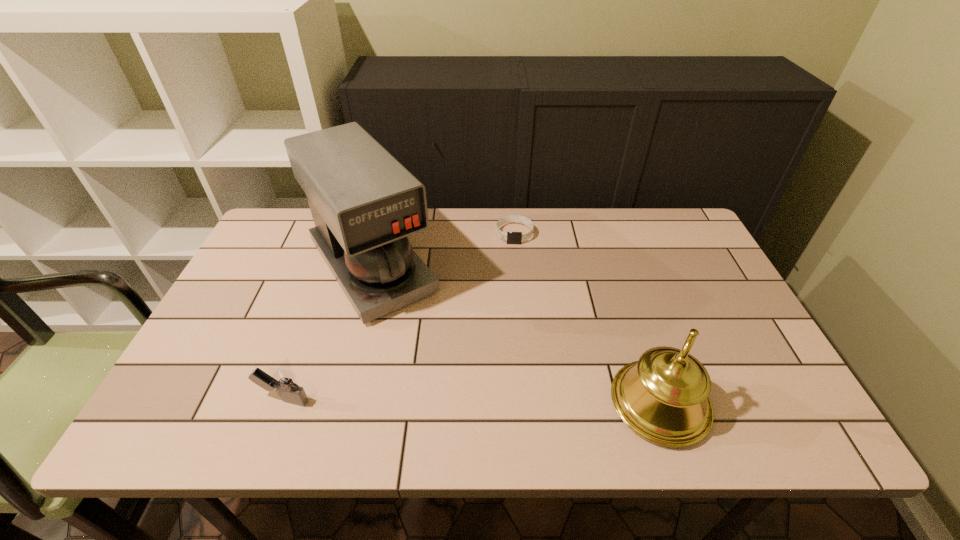
This screenshot has width=960, height=540. I want to click on vacant space at the far edge, so click(x=502, y=253).

The height and width of the screenshot is (540, 960). In the image, there is a desktop. Identify the location of blank space at the near edge. (486, 401).

The image size is (960, 540). In the image, there is a desktop. What are the coordinates of `vacant space at the left edge` in the screenshot? It's located at (269, 294).

In order to click on vacant area at the right edge of the desktop in this screenshot , I will do `click(707, 263)`.

You are a GUI agent. You are given a task and a screenshot of the screen. Output one action in this format:
    pyautogui.click(x=<x>, y=<y>)
    Task: Click on the vacant space at the near left corner
    Image resolution: width=960 pixels, height=540 pixels.
    Given the screenshot: What is the action you would take?
    pyautogui.click(x=220, y=377)

At what (x,y) coordinates should I click in order to perform the action: click on vacant space at the far right corner of the desktop. Please return your answer as a coordinate pair (x, y). The height and width of the screenshot is (540, 960). Looking at the image, I should click on (675, 233).

This screenshot has height=540, width=960. Identify the location of vacant space that's between the second object from right to left and the third shortest object. (587, 319).

The image size is (960, 540). Identify the location of vacant space in between the coffee maker and the igniter. (327, 334).

You are a GUI agent. You are given a task and a screenshot of the screen. Output one action in this format:
    pyautogui.click(x=<x>, y=<y>)
    Task: Click on the blank region between the igniter and the coffee maker
    Image resolution: width=960 pixels, height=540 pixels.
    Given the screenshot: What is the action you would take?
    pyautogui.click(x=327, y=334)

Locate an element on the screen. free area in between the second object from right to left and the third shortest object is located at coordinates (x=587, y=319).